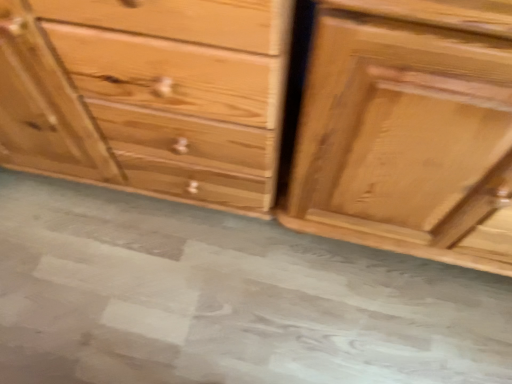
Identify the location of blank space above gray concrete at center (from a real-world perspective). (x=212, y=293).